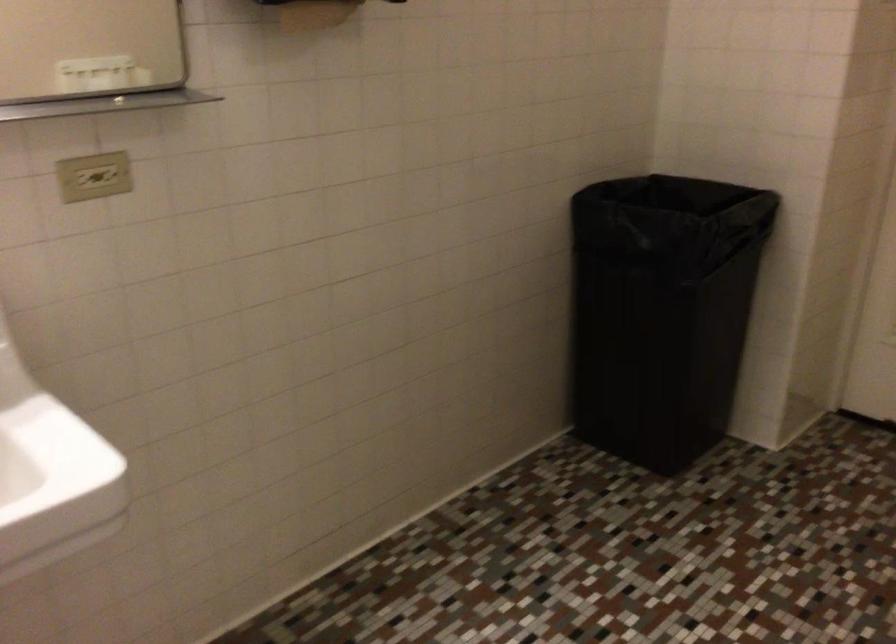
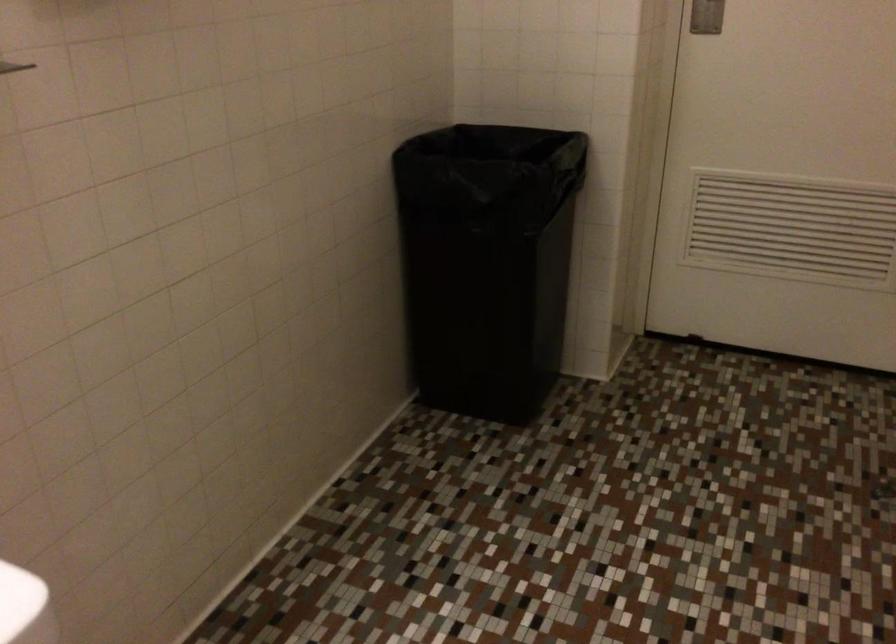
Which direction would the cameraman need to move to produce the second image?

The cameraman moved toward left, forward.